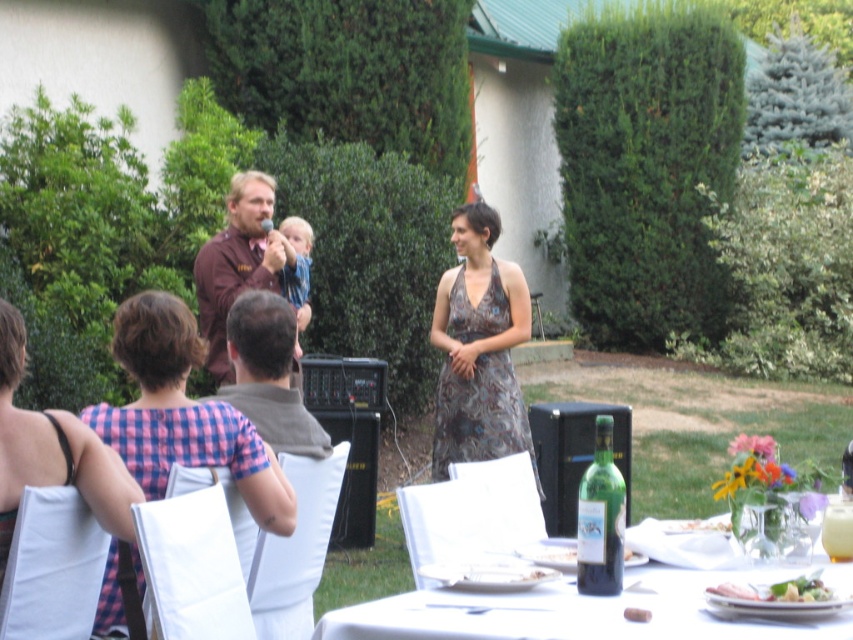
You are at a garden party and see the brown textured dress at center and the white porcelain plate at lower center. Which object is taller?

The brown textured dress at center is much taller than the white porcelain plate at lower center.

You are a photographer setting up for a group photo at the event. You need to ensure that the pink checkered dress at left and the green glass bottle at lower center are both visible in the frame. Considering their heights, which object will appear taller in the photo?

The pink checkered dress at left is taller than the green glass bottle at lower center, so it will appear taller in the photo.